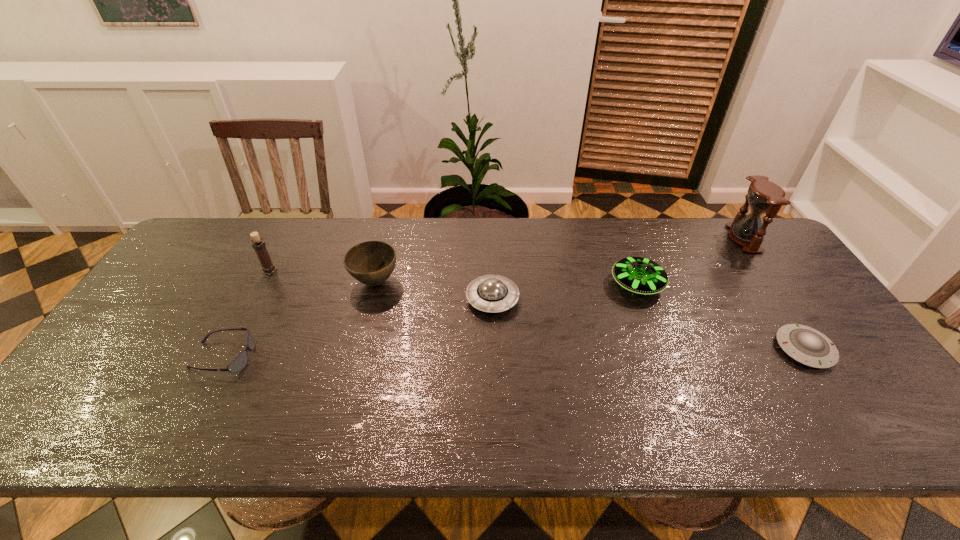
Identify the location of the shortest saucer. (804, 344).

In order to click on the rightmost saucer in this screenshot , I will do `click(804, 344)`.

Image resolution: width=960 pixels, height=540 pixels. In order to click on free space located on the front of the hourglass in this screenshot , I will do `click(768, 273)`.

Identify the location of free location located on the left of the candle holder. The height and width of the screenshot is (540, 960). (181, 271).

Where is `vacant space located on the right of the third object from left to right`? The height and width of the screenshot is (540, 960). vacant space located on the right of the third object from left to right is located at coordinates (508, 282).

Find the location of a particular element. free location located 0.130m on the right of the fourth tallest object is located at coordinates (708, 285).

Locate an element on the screen. The width and height of the screenshot is (960, 540). vacant space located on the back of the fifth tallest object is located at coordinates coord(492,255).

Find the location of a particular element. The height and width of the screenshot is (540, 960). free space located 0.200m on the lenses of the second shortest object is located at coordinates (332, 357).

This screenshot has height=540, width=960. What are the coordinates of `free space located 0.190m on the back of the shortest object` in the screenshot? It's located at (757, 279).

This screenshot has width=960, height=540. What are the coordinates of `object located in the far edge section of the desktop` in the screenshot? It's located at (764, 196).